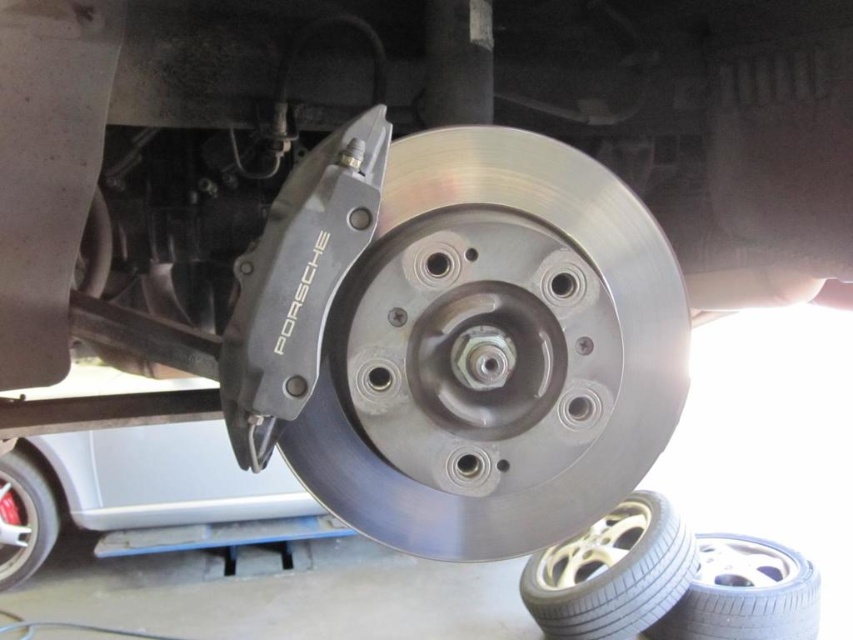
Question: Among these points, which one is farthest from the camera?

Choices:
 (A) (709, 534)
 (B) (3, 492)
 (C) (651, 561)

Answer: (B)

Question: Can you confirm if black rubber tire at lower right is positioned to the left of brushed metal tire at lower left?

Choices:
 (A) no
 (B) yes

Answer: (A)

Question: Which point is closer to the camera?

Choices:
 (A) white rubber tire at lower right
 (B) black rubber tire at lower right

Answer: (B)

Question: Among these points, which one is farthest from the camera?

Choices:
 (A) (666, 614)
 (B) (13, 582)
 (C) (581, 563)

Answer: (B)

Question: Is black rubber tire at lower right below brushed metal tire at lower left?

Choices:
 (A) yes
 (B) no

Answer: (A)

Question: Does white rubber tire at lower right appear on the right side of black rubber tire at lower right?

Choices:
 (A) no
 (B) yes

Answer: (A)